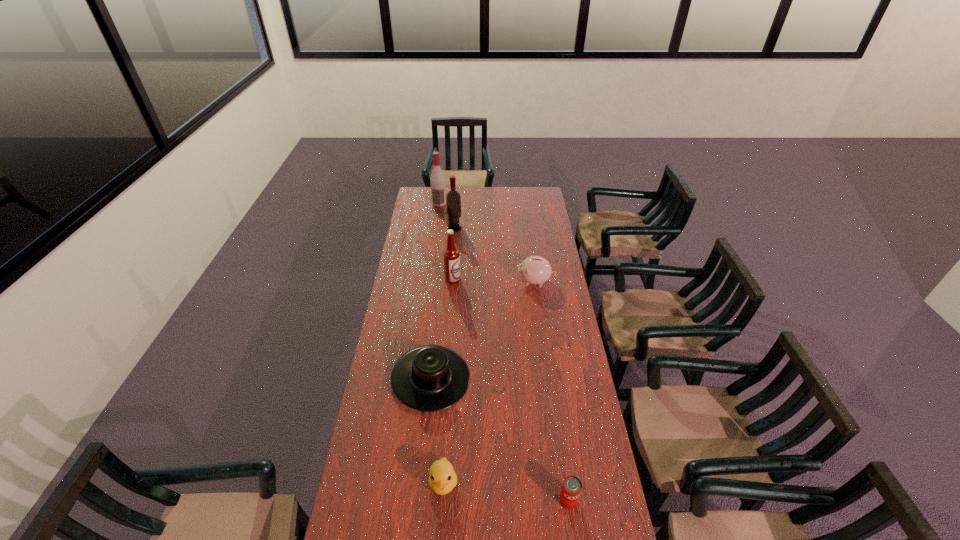
Find the location of `the farthest object`. the farthest object is located at coordinates (437, 180).

Identify the location of the leftmost alcohol. (437, 180).

Where is `the second farthest alcohol`? This screenshot has height=540, width=960. the second farthest alcohol is located at coordinates (453, 199).

Where is `the nearest alcohol`? the nearest alcohol is located at coordinates [x=451, y=254].

Where is `piggy bank`? piggy bank is located at coordinates (535, 270).

Find the location of `duck`. duck is located at coordinates pyautogui.click(x=442, y=478).

Identify the location of dress hat. (429, 378).

Find the location of a particular element. can is located at coordinates (571, 488).

I want to click on free location located on the label of the leftmost alcohol, so click(x=437, y=224).

The image size is (960, 540). In order to click on vacant position located on the front and back of the second farthest alcohol in this screenshot , I will do `click(498, 228)`.